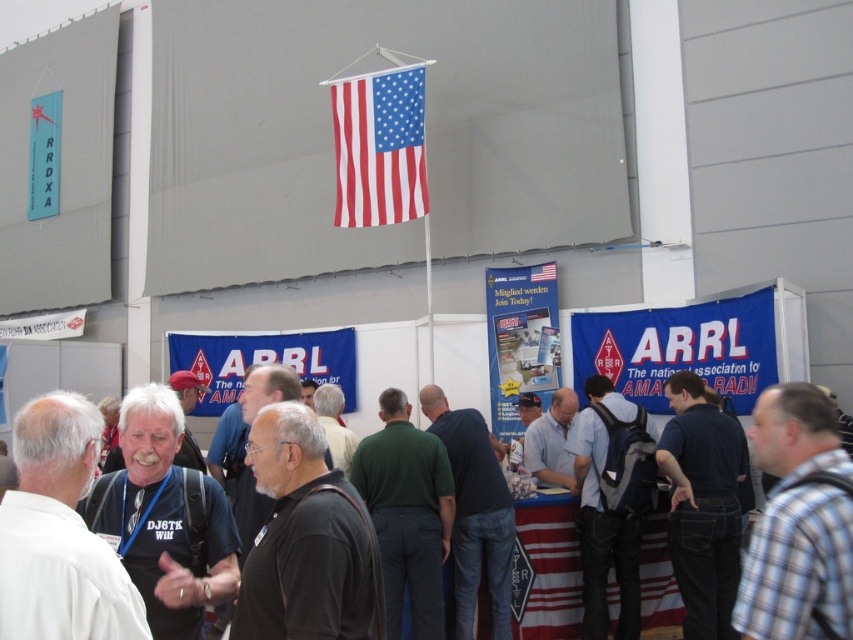
You are an event photographer at the ARRL booth. You need to capture a photo that includes both the dark blue shirt at center and the black shirt at center. Which shirt should you focus on first to ensure both are in frame?

The dark blue shirt at center is larger in size than the black shirt at center, so you should focus on the dark blue shirt at center first to ensure both are in frame.